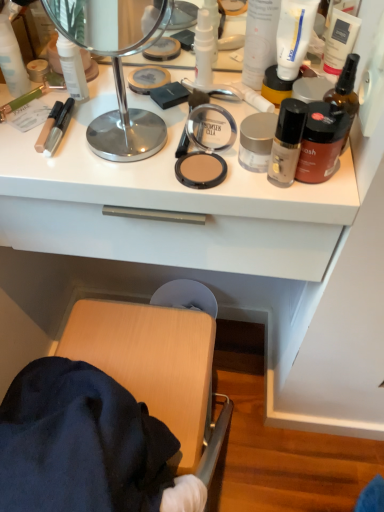
At what (x,y) coordinates should I click in order to perform the action: click on free space to the left of matte brown compact at center. Please return your answer as a coordinate pair (x, y). Image resolution: width=384 pixels, height=512 pixels. Looking at the image, I should click on (99, 162).